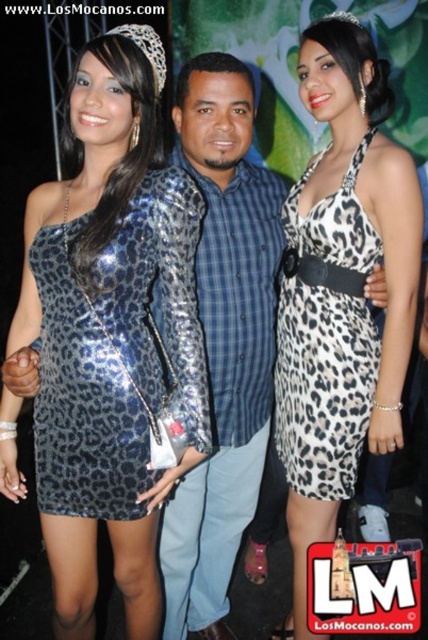
Question: Can you confirm if shiny metallic dress at center is positioned to the right of leopard print dress at center?

Choices:
 (A) yes
 (B) no

Answer: (B)

Question: Among these objects, which one is farthest from the camera?

Choices:
 (A) leopard print dress at center
 (B) shiny metallic dress at center
 (C) leopard print fabric dress at center

Answer: (C)

Question: Where is shiny metallic dress at center located in relation to leopard print fabric dress at center in the image?

Choices:
 (A) below
 (B) above

Answer: (A)

Question: Which of the following is the farthest from the observer?

Choices:
 (A) (284, 336)
 (B) (219, 148)
 (C) (342, 488)

Answer: (A)

Question: Is leopard print dress at center wider than leopard print fabric dress at center?

Choices:
 (A) yes
 (B) no

Answer: (A)

Question: Which of these objects is positioned closest to the shiny metallic jacket at center?

Choices:
 (A) shiny metallic dress at center
 (B) leopard print dress at center

Answer: (B)